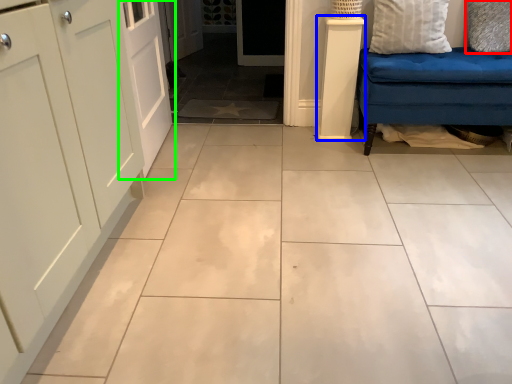
Question: Estimate the real-world distances between objects in this image. Which object is closer to pillow (highlighted by a red box), pillar (highlighted by a blue box) or door (highlighted by a green box)?

Choices:
 (A) pillar
 (B) door

Answer: (A)